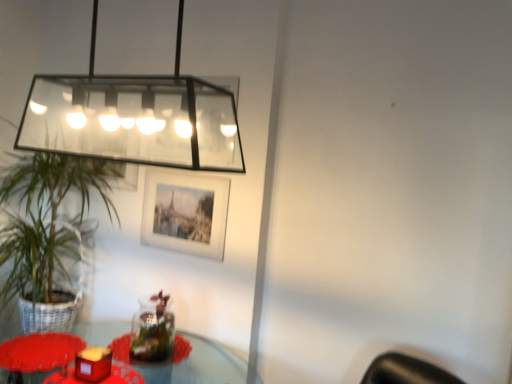
This screenshot has width=512, height=384. Identify the location of vacant area on top of matte red candle at lower left (from a real-world perspective). (39, 345).